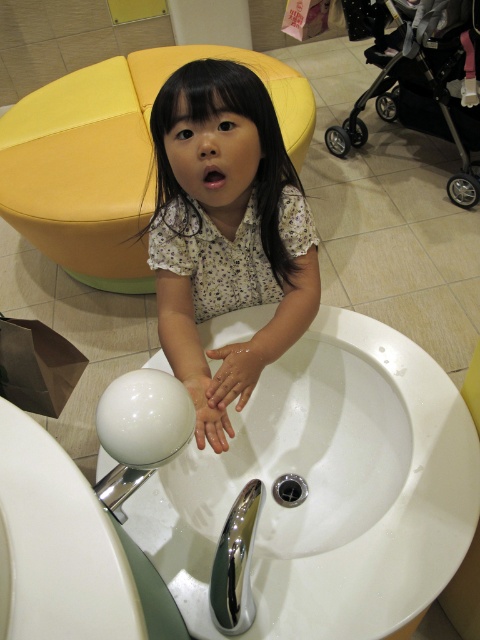
You are a parent in a public restroom. You see your child has their glossy skin hands at center near the chrome metallic faucet at lower center. Is there a risk of the child getting wet from the faucet?

The glossy skin hands at center is positioned over the chrome metallic faucet at lower center, so yes, the child is likely getting wet from the faucet as their hands are directly above it.

You are a parent trying to park your metallic stroller at upper right in the public restroom. The stroller is currently at point (424, 86). You want to move it to the yellow, segmented, cushioned bench with green base. Which direction should you move the stroller to get closer to the bench?

The metallic stroller at upper right is located at point (424, 86). To move it towards the yellow, segmented, cushioned bench with green base, you should move it downward since the bench is positioned lower than the stroller.

You are a parent trying to determine if your metallic stroller at upper right can fit through the doorway next to the glossy skin hands at center. Based on their sizes, can the stroller pass through?

The metallic stroller at upper right is larger in size than the glossy skin hands at center, so it may not fit through the doorway unless the doorway is wider than the stroller.